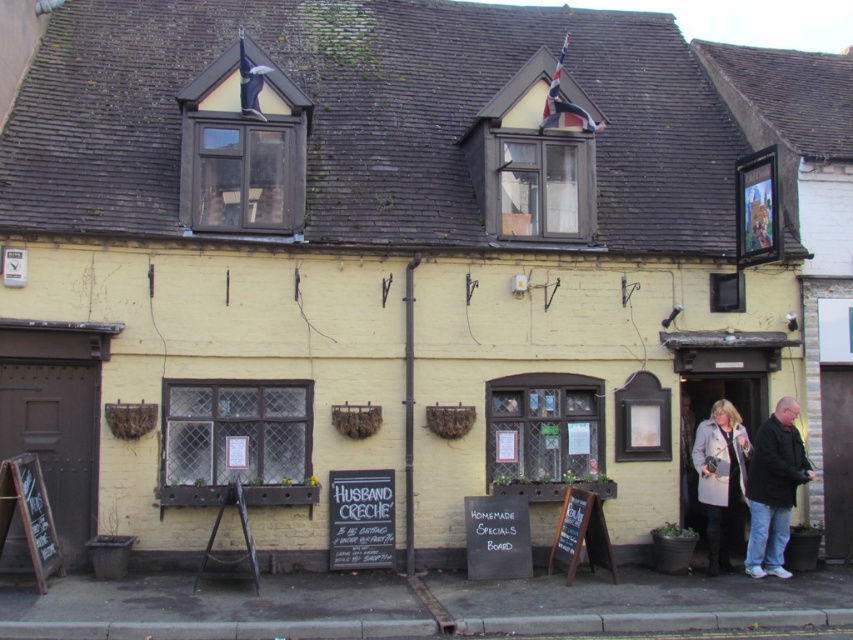
Question: Is gray wool coat at lower right below wooden chalkboard at lower left?

Choices:
 (A) yes
 (B) no

Answer: (B)

Question: Among these points, which one is nearest to the camera?

Choices:
 (A) (730, 452)
 (B) (61, 572)
 (C) (791, 401)

Answer: (B)

Question: Can you confirm if leather jacket at lower right is positioned below wooden chalkboard at lower left?

Choices:
 (A) no
 (B) yes

Answer: (A)

Question: Considering the real-world distances, which object is farthest from the gray wool coat at lower right?

Choices:
 (A) leather jacket at lower right
 (B) wooden chalkboard at lower left

Answer: (B)

Question: Which point is closer to the camera?

Choices:
 (A) leather jacket at lower right
 (B) gray wool coat at lower right
 (C) wooden chalkboard at lower left

Answer: (C)

Question: Is gray wool coat at lower right in front of wooden chalkboard at lower left?

Choices:
 (A) yes
 (B) no

Answer: (B)